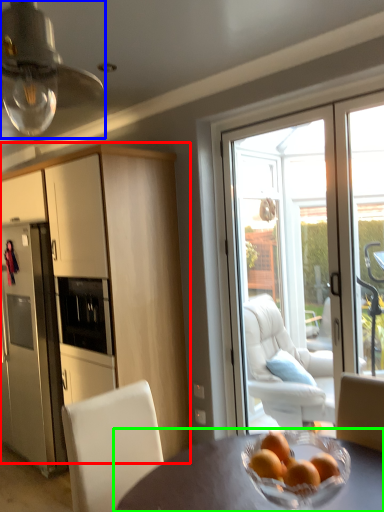
Question: Estimate the real-world distances between objects in this image. Which object is closer to cabinetry (highlighted by a red box), light fixture (highlighted by a blue box) or table (highlighted by a green box)?

Choices:
 (A) light fixture
 (B) table

Answer: (A)